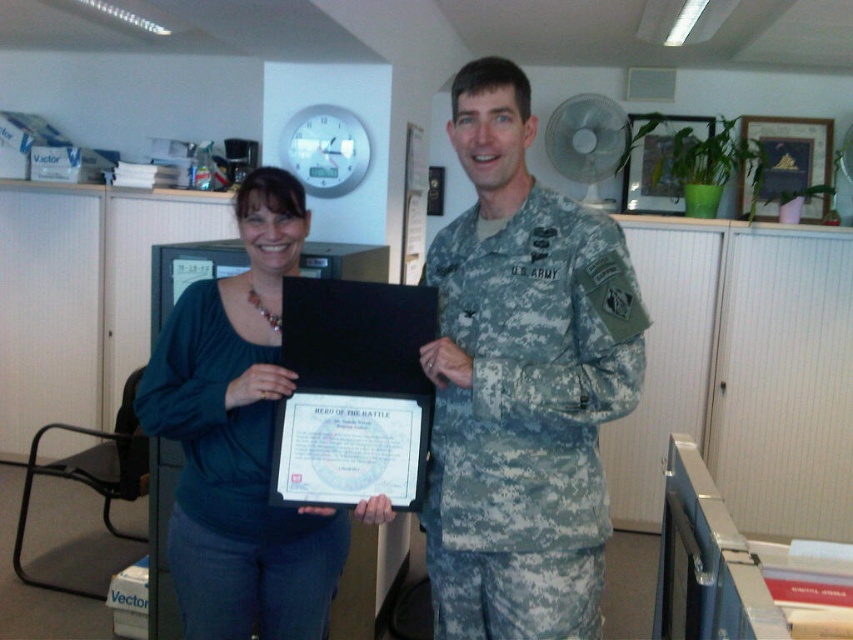
Can you confirm if camouflage uniform at center is positioned to the left of teal fabric shirt at center?

No, camouflage uniform at center is not to the left of teal fabric shirt at center.

Find the location of a particular element. This screenshot has height=640, width=853. camouflage uniform at center is located at coordinates (521, 381).